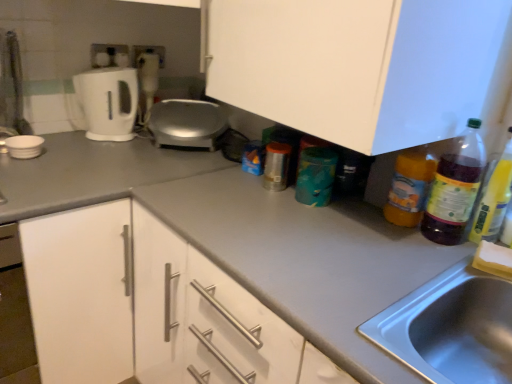
Identify the location of empty space that is ontop of gray matte countertop at center. (337, 236).